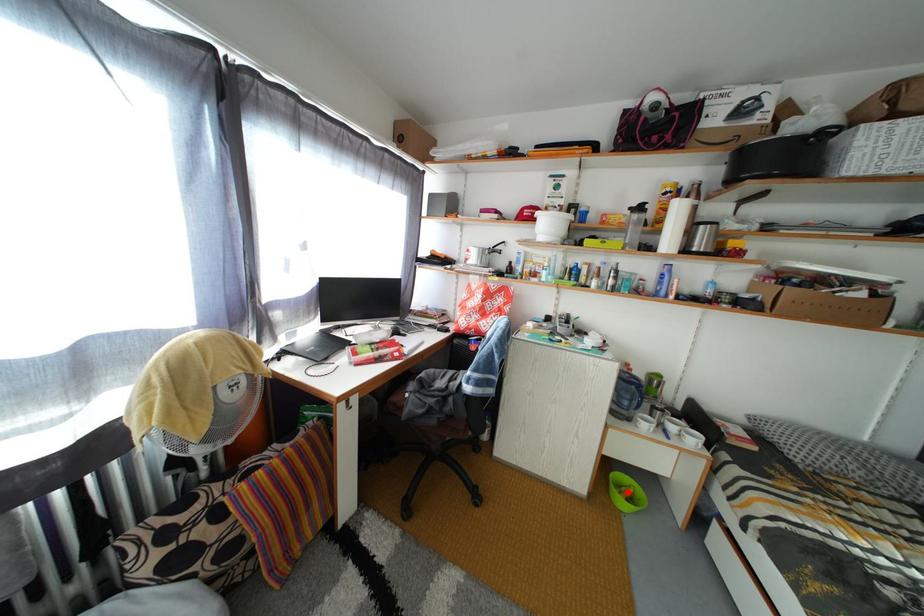
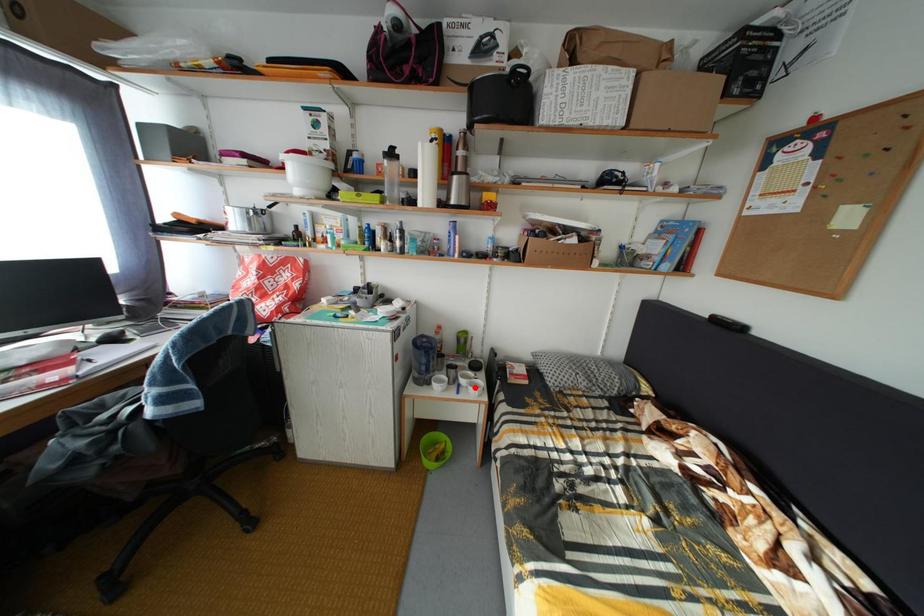
I am providing you with two images of the same scene from different viewpoints. A red point is marked on the first image and another point is marked on the second image. Does the point marked in image1 correspond to the same location as the one in image2?

No